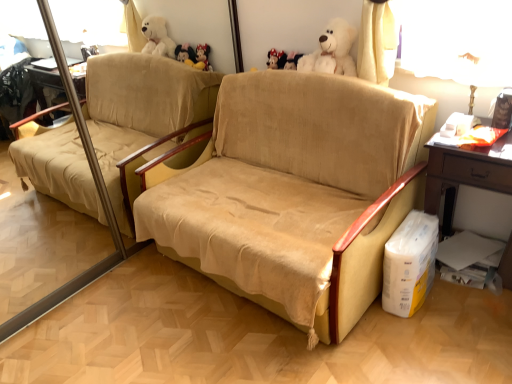
Find the location of `vacant space in between wooden table at right and white cardboard box at lower right`. vacant space in between wooden table at right and white cardboard box at lower right is located at coordinates (453, 306).